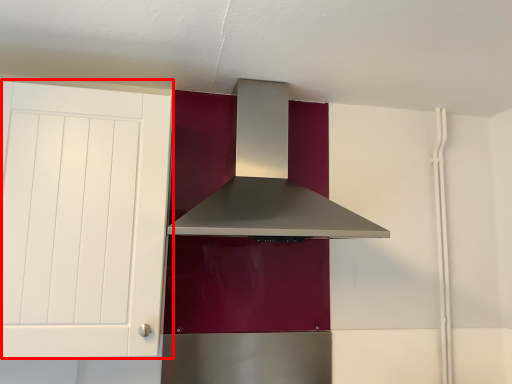
Question: From the image, what is the correct spatial relationship of cabinetry (annotated by the red box) in relation to home appliance?

Choices:
 (A) left
 (B) right

Answer: (A)